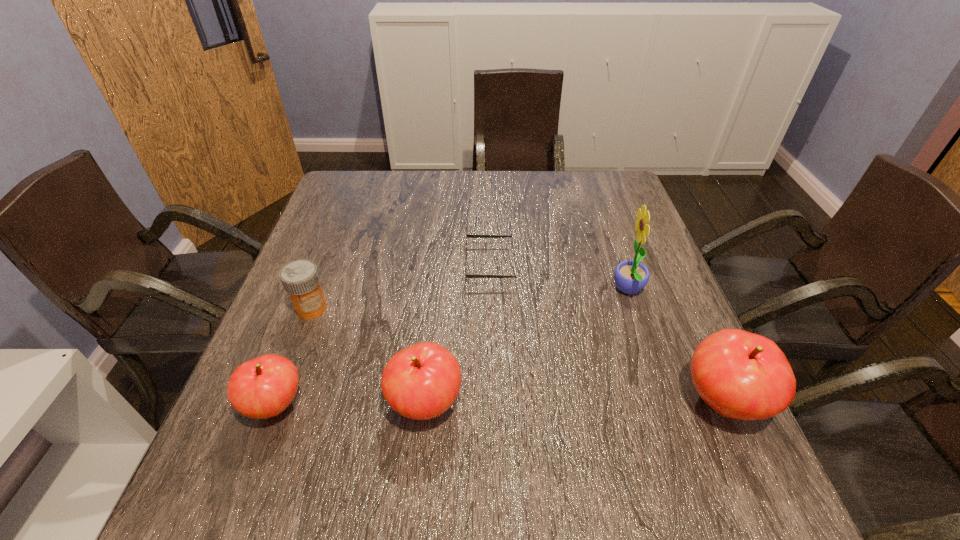
Locate which object is the closest to the rightmost apple. Please provide its 2D coordinates. Your answer should be formatted as a tuple, i.e. [(x, y)], where the tuple contains the x and y coordinates of a point satisfying the conditions above.

[(630, 277)]

Identify the location of apple that stands as the second closest to the shortest apple. This screenshot has height=540, width=960. (741, 375).

The height and width of the screenshot is (540, 960). Identify the location of apple that is the second closest to the leftmost apple. (741, 375).

Find the location of a particular element. free location that satisfies the following two spatial constraints: 1. on the label side of the second apple from left to right; 2. on the left side of the medicine is located at coordinates (276, 403).

Where is `vacant point that satisfies the following two spatial constraints: 1. on the front-facing side of the tallest object; 2. on the label side of the medicine`? The image size is (960, 540). vacant point that satisfies the following two spatial constraints: 1. on the front-facing side of the tallest object; 2. on the label side of the medicine is located at coordinates (635, 308).